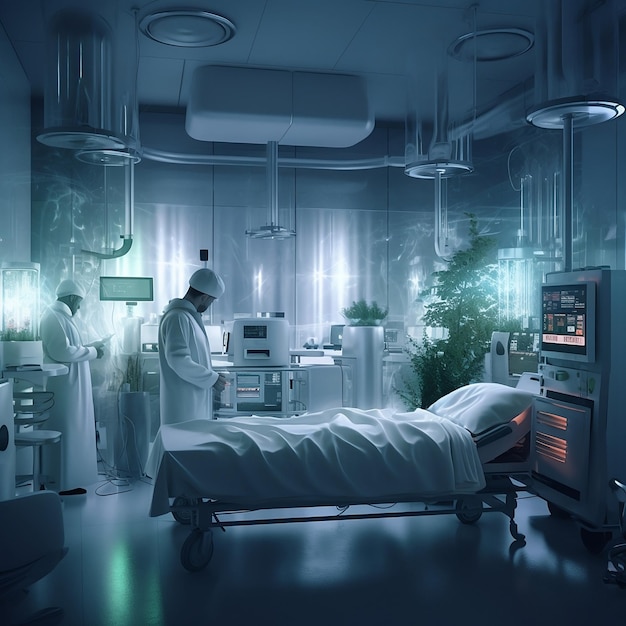
This screenshot has height=626, width=626. Find the location of `glowing light`. glowing light is located at coordinates (556, 453).